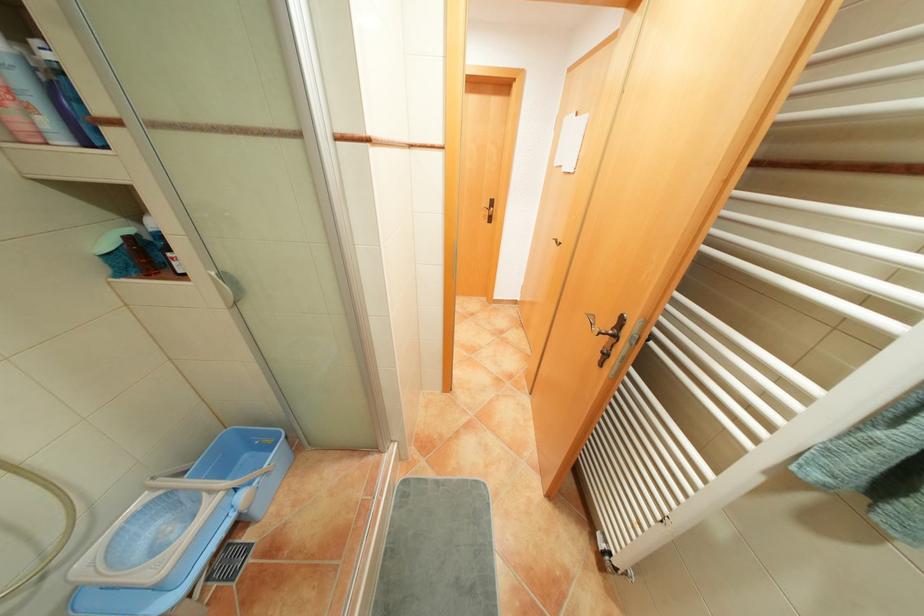
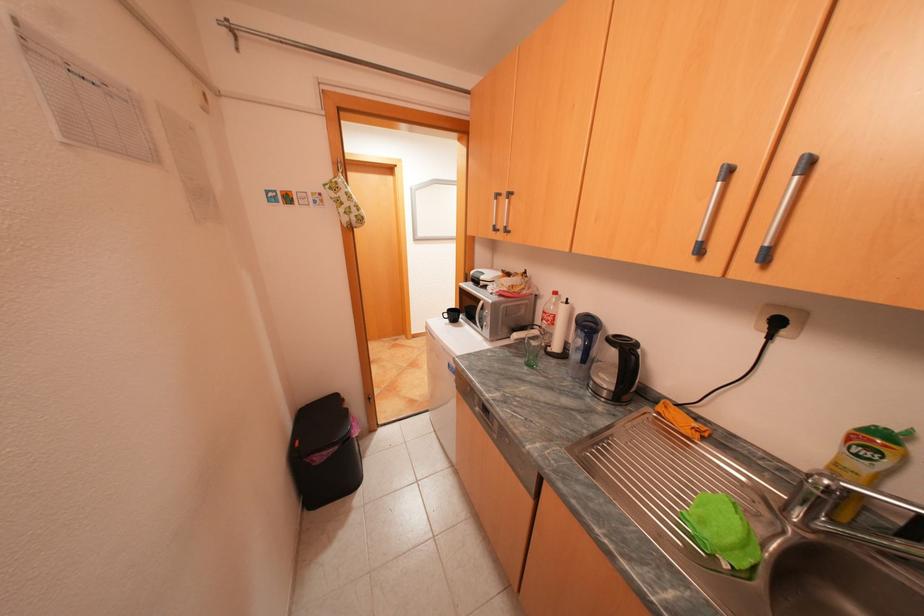
Question: The images are taken continuously from a first-person perspective. In which direction are you moving?

Choices:
 (A) Left
 (B) Right
 (C) Forward
 (D) Backward

Answer: (A)